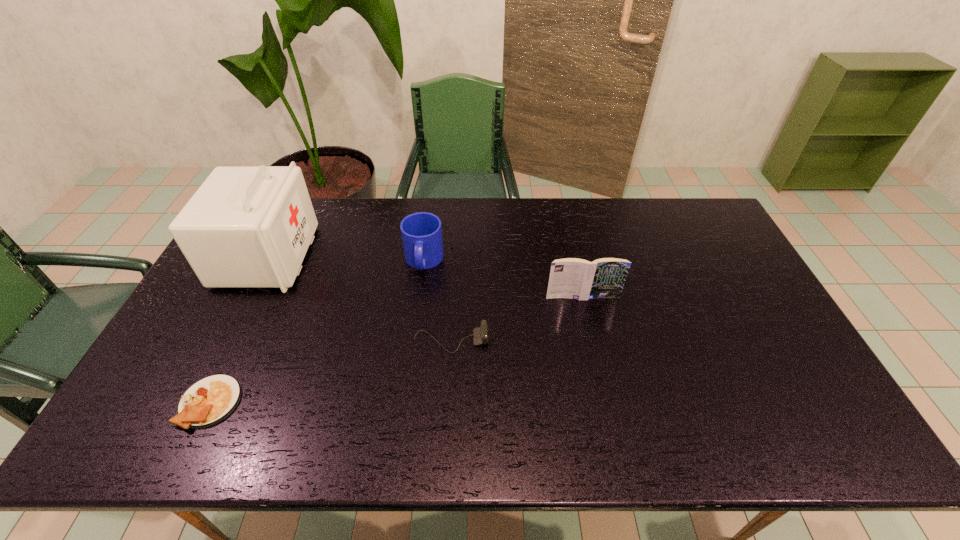
Identify the location of free space at the right edge of the desktop. (721, 308).

The image size is (960, 540). In order to click on vacant space at the far right corner of the desktop in this screenshot , I will do `click(700, 205)`.

In order to click on free space between the webcam and the tallest object in this screenshot , I will do `click(359, 299)`.

Where is `free point between the fourth tallest object and the shortest object`? free point between the fourth tallest object and the shortest object is located at coordinates (x=330, y=372).

Where is `vacant area between the second shortest object and the mug`? vacant area between the second shortest object and the mug is located at coordinates (438, 301).

Locate an element on the screen. empty space between the rightmost object and the shortest object is located at coordinates (396, 350).

This screenshot has width=960, height=540. What are the coordinates of `free point between the book and the first-aid kit` in the screenshot? It's located at (425, 277).

Where is `free point between the rightmost object and the first-aid kit`? This screenshot has width=960, height=540. free point between the rightmost object and the first-aid kit is located at coordinates (425, 277).

I want to click on vacant region between the mug and the tallest object, so click(x=346, y=259).

The height and width of the screenshot is (540, 960). What are the coordinates of `empty location between the first-aid kit and the second nearest object` in the screenshot? It's located at (359, 299).